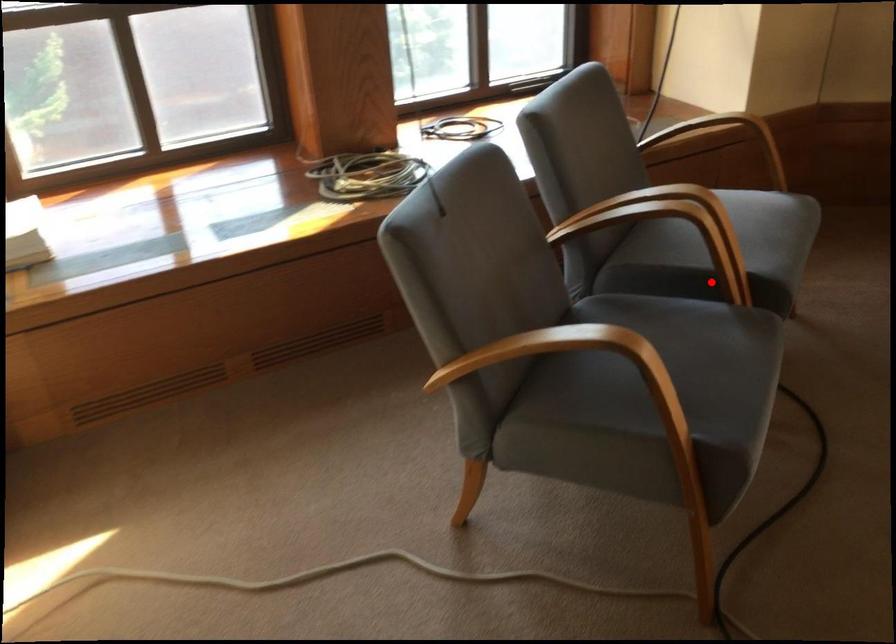
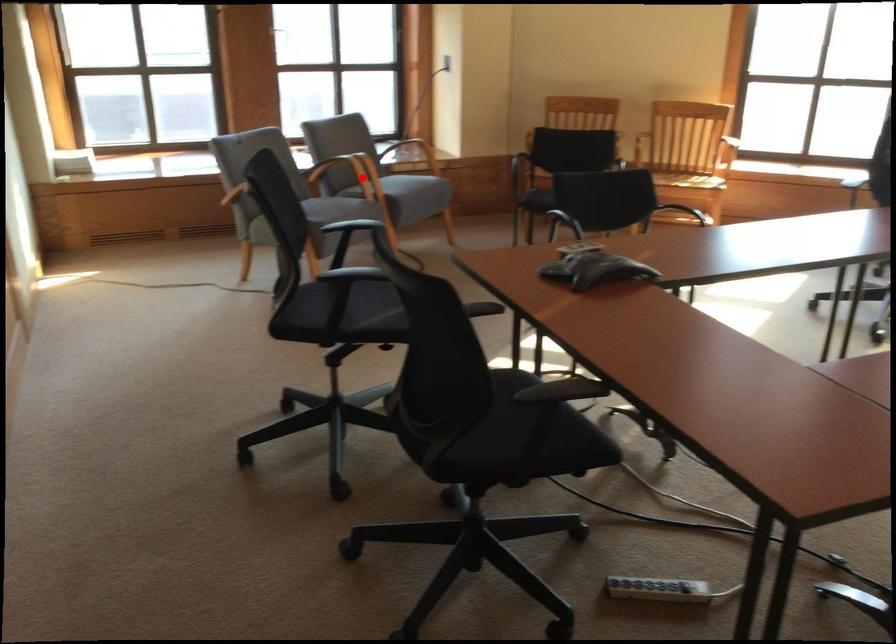
I am providing you with two images of the same scene from different viewpoints. A red point is marked on the first image and another point is marked on the second image. Is the red point in image1 aligned with the point shown in image2?

Yes